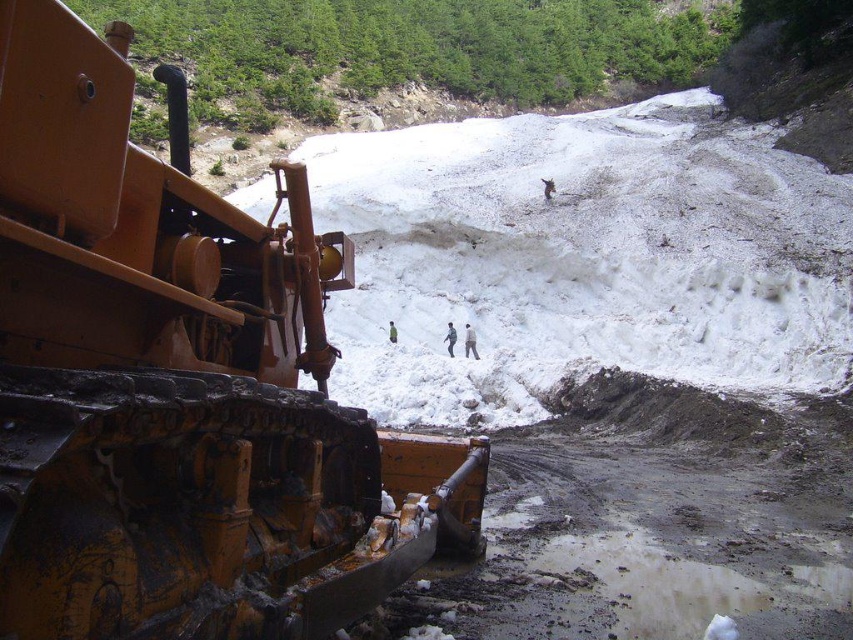
Question: Is matte yellow tractor at left to the right of green fabric jacket at center from the viewer's perspective?

Choices:
 (A) yes
 (B) no

Answer: (B)

Question: Can you confirm if matte yellow tractor at left is positioned below dark gray fabric jacket at center?

Choices:
 (A) no
 (B) yes

Answer: (A)

Question: Is light brown fabric jacket at center smaller than dark gray fabric jacket at center?

Choices:
 (A) yes
 (B) no

Answer: (A)

Question: Which of the following is the farthest from the observer?

Choices:
 (A) green fabric jacket at center
 (B) dark gray fabric jacket at center
 (C) matte yellow tractor at left
 (D) light brown fabric jacket at center

Answer: (A)

Question: Which of the following is the farthest from the observer?

Choices:
 (A) dark gray fabric jacket at center
 (B) light brown fabric jacket at center

Answer: (A)

Question: Which object appears farthest from the camera in this image?

Choices:
 (A) green fabric jacket at center
 (B) matte yellow tractor at left
 (C) light brown fabric jacket at center
 (D) dark gray fabric jacket at center

Answer: (A)